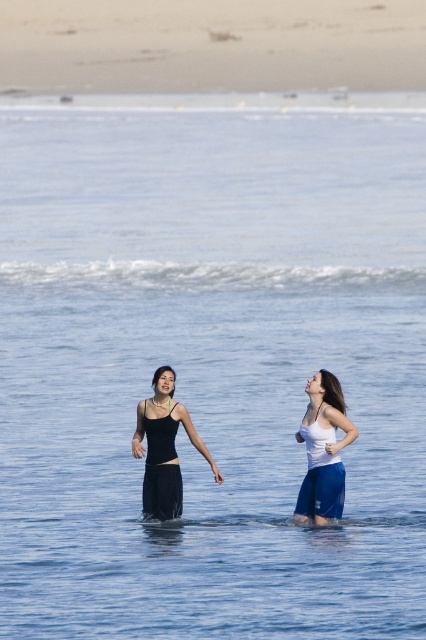
Question: Among these objects, which one is nearest to the camera?

Choices:
 (A) black matte dress at center
 (B) matte black dress at center

Answer: (B)

Question: Estimate the real-world distances between objects in this image. Which object is closer to the black matte dress at center?

Choices:
 (A) smooth sand at upper center
 (B) matte black dress at center
 (C) white matte tank top at center

Answer: (B)

Question: Estimate the real-world distances between objects in this image. Which object is closer to the white matte tank top at center?

Choices:
 (A) black matte dress at center
 (B) matte black dress at center
 (C) smooth sand at upper center

Answer: (B)

Question: Does smooth sand at upper center have a smaller size compared to white matte tank top at center?

Choices:
 (A) no
 (B) yes

Answer: (A)

Question: Does white matte tank top at center have a lesser width compared to matte black dress at center?

Choices:
 (A) no
 (B) yes

Answer: (B)

Question: Is matte black dress at center positioned before black matte dress at center?

Choices:
 (A) no
 (B) yes

Answer: (B)